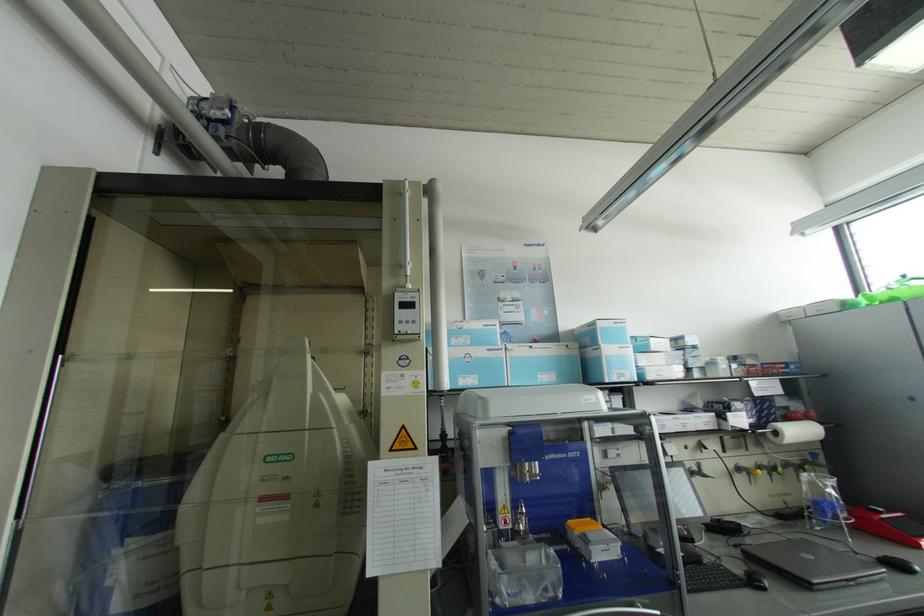
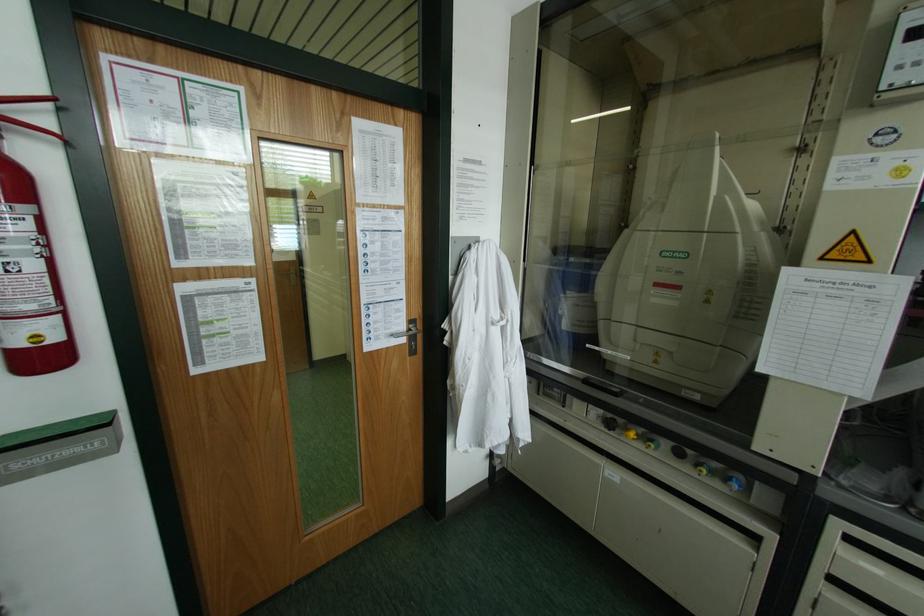
Locate, in the second image, the point that corresponds to (x=366, y=352) in the first image.

(800, 148)